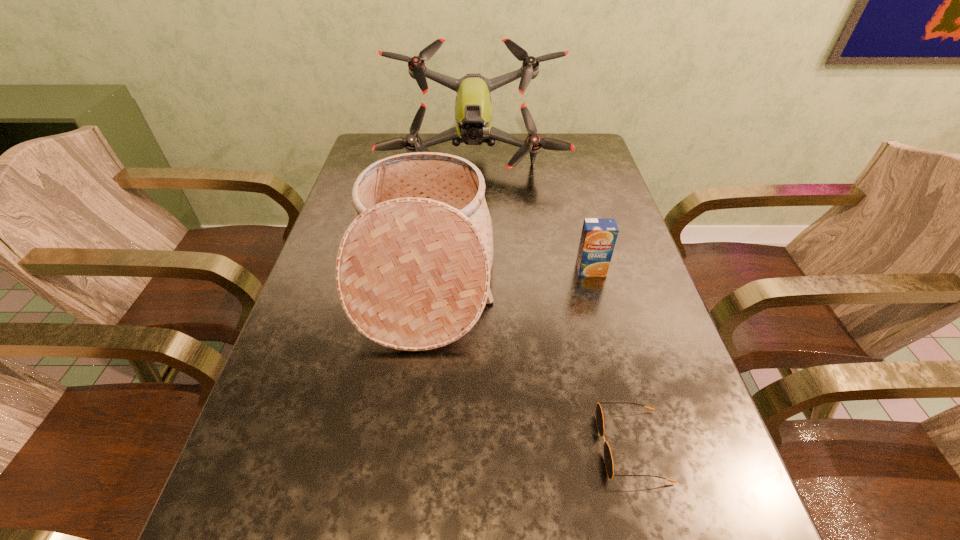
Locate an element on the screen. vacant space at the right edge of the desktop is located at coordinates (604, 192).

This screenshot has height=540, width=960. In order to click on free space at the far right corner of the desktop in this screenshot , I will do `click(578, 145)`.

In order to click on free area in between the third shortest object and the sunglasses in this screenshot , I will do `click(528, 361)`.

This screenshot has width=960, height=540. I want to click on vacant area that lies between the nearest object and the second shortest object, so click(612, 358).

The height and width of the screenshot is (540, 960). I want to click on free space that is in between the third tallest object and the second tallest object, so click(508, 273).

What are the coordinates of `unoccupied position between the shortest object and the second shortest object` in the screenshot? It's located at (612, 358).

At what (x,y) coordinates should I click in order to perform the action: click on free space between the basket and the second shortest object. Please return your answer as a coordinate pair (x, y). Image resolution: width=960 pixels, height=540 pixels. Looking at the image, I should click on (508, 273).

Identify the location of vacant point located between the basket and the third tallest object. This screenshot has width=960, height=540. (508, 273).

Image resolution: width=960 pixels, height=540 pixels. Find the location of `empty space that is in between the drone and the shortest object`. empty space that is in between the drone and the shortest object is located at coordinates (553, 301).

Where is `free spot between the sunglasses and the farthest object`? free spot between the sunglasses and the farthest object is located at coordinates (553, 301).